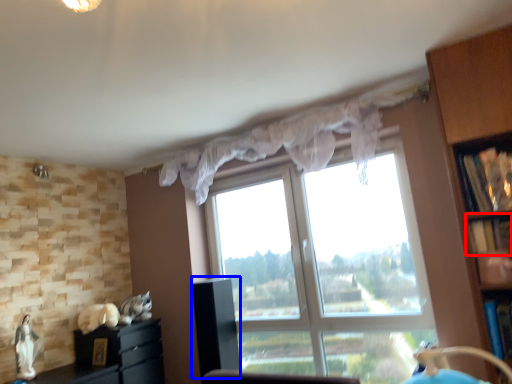
Question: Which point is closer to the camera, shelf (highlighted by a red box) or cabinetry (highlighted by a blue box)?

Choices:
 (A) shelf
 (B) cabinetry

Answer: (A)